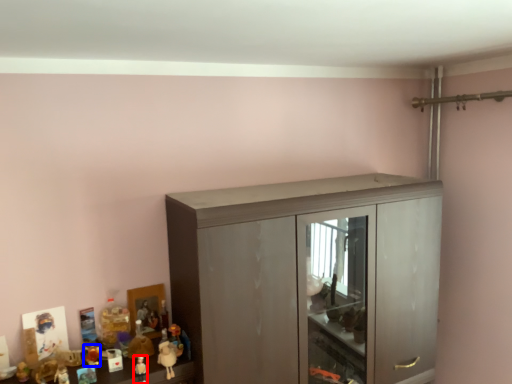
Question: Which object is further to the camera taking this photo, toy (highlighted by a red box) or toy (highlighted by a blue box)?

Choices:
 (A) toy
 (B) toy

Answer: (B)